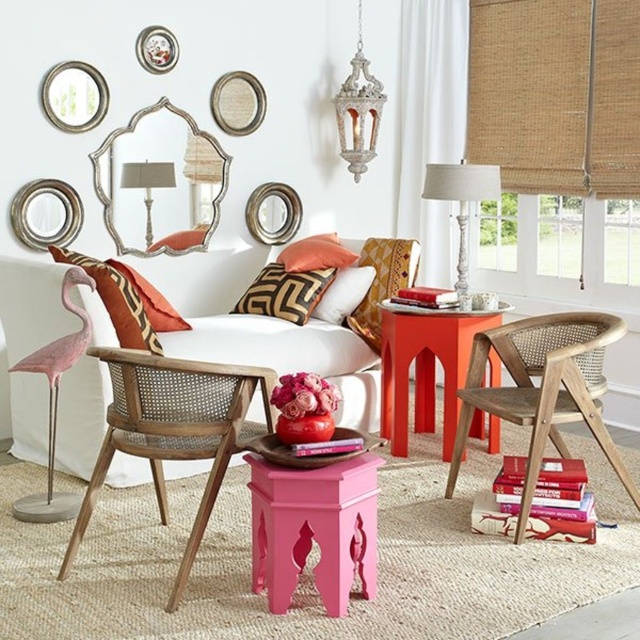
You are arranging a small plant on the coffee table between the white textured table lamp at right and the patterned fabric pillow at center. If the plant requires at least 15 cm of space to grow, will there be enough space between them?

The white textured table lamp at right is wider than the patterned fabric pillow at center. However, the exact distance between them isn not specified in the objects description. Therefore, it is uncertain if the 15 cm space requirement is met.

You are sitting on the floor in the living room and want to place a book on the white fabric couch at center and the pink fabric pillow at left. Which surface will require you to reach higher to place the book?

The white fabric couch at center requires reaching higher since it has a greater height compared to the pink fabric pillow at left.

You are sitting on the white fabric couch at center and want to place a book on the pink fabric pillow at left. Can you reach it without moving from the couch?

The white fabric couch at center is located below the pink fabric pillow at left, so you can easily reach the pink fabric pillow at left from the couch without needing to move.